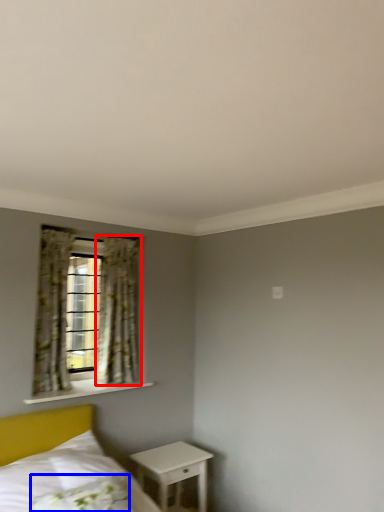
Question: Which object is closer to the camera taking this photo, curtain (highlighted by a red box) or pillow (highlighted by a blue box)?

Choices:
 (A) curtain
 (B) pillow

Answer: (B)